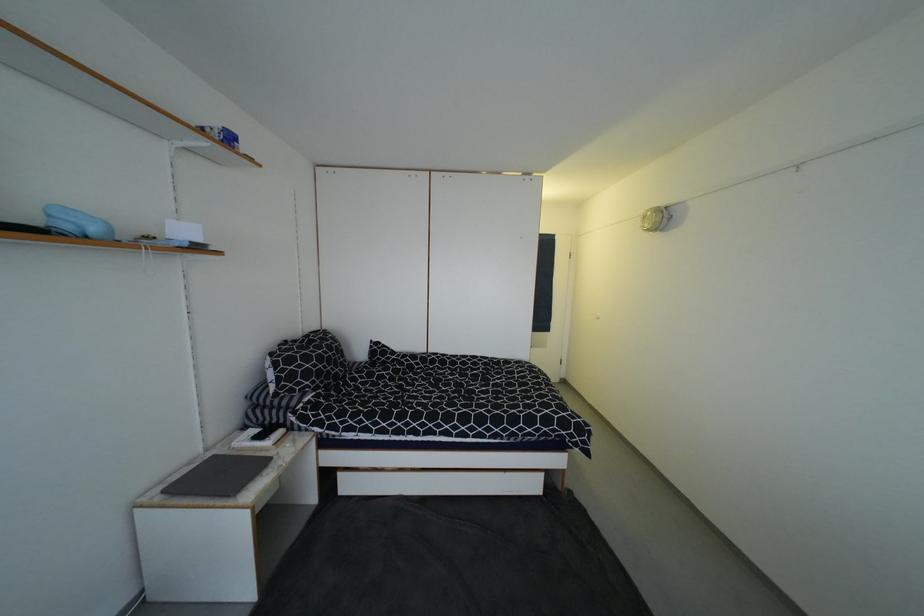
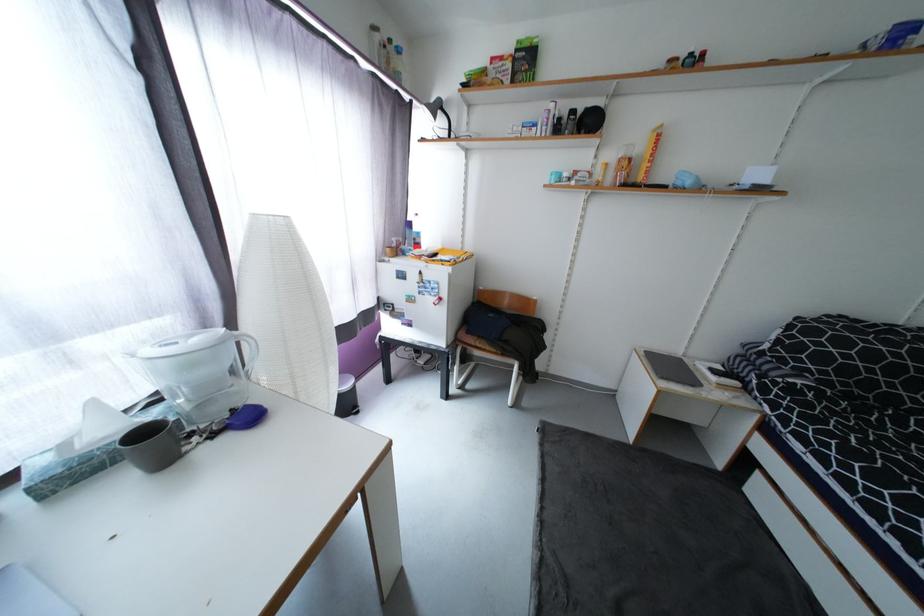
Find the pixel in the second image that matches point (286, 434) in the first image.

(740, 385)